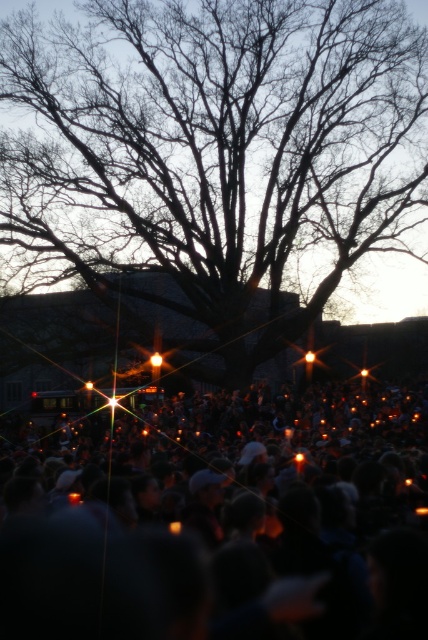
Question: Does silhouette bare branches at center have a lesser width compared to orange candle at lower center?

Choices:
 (A) yes
 (B) no

Answer: (B)

Question: Is silhouette bare branches at center to the left of orange candle at lower center from the viewer's perspective?

Choices:
 (A) yes
 (B) no

Answer: (A)

Question: Among these objects, which one is farthest from the camera?

Choices:
 (A) silhouette bare branches at center
 (B) orange candle at lower center

Answer: (A)

Question: Which point is closer to the camera?

Choices:
 (A) silhouette bare branches at center
 (B) orange candle at lower center

Answer: (B)

Question: Which point appears farthest from the camera in this image?

Choices:
 (A) (127, 426)
 (B) (359, 189)

Answer: (B)

Question: Does silhouette bare branches at center have a larger size compared to orange candle at lower center?

Choices:
 (A) no
 (B) yes

Answer: (B)